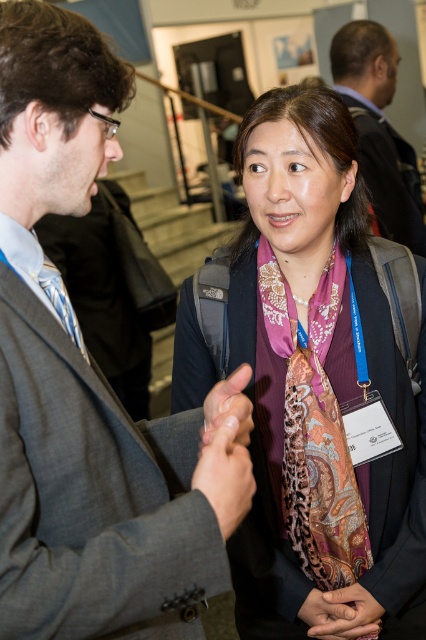
Question: Which object is closer to the camera taking this photo?

Choices:
 (A) matte gray tie at left
 (B) purple silk scarf at center
 (C) dark brown leather jacket at upper right
 (D) paisley-patterned silk scarf at center

Answer: (A)

Question: Which point is closer to the camera?

Choices:
 (A) purple silk scarf at center
 (B) gray suit at center
 (C) paisley-patterned silk scarf at center

Answer: (B)

Question: Where is purple silk scarf at center located in relation to dark brown leather jacket at upper right in the image?

Choices:
 (A) below
 (B) above

Answer: (A)

Question: Does paisley-patterned silk scarf at center appear over matte gray tie at left?

Choices:
 (A) yes
 (B) no

Answer: (B)

Question: Is purple silk scarf at center closer to camera compared to matte gray tie at left?

Choices:
 (A) yes
 (B) no

Answer: (B)

Question: Estimate the real-world distances between objects in this image. Which object is closer to the purple silk scarf at center?

Choices:
 (A) matte gray tie at left
 (B) dark brown leather jacket at upper right
 (C) paisley-patterned silk scarf at center
 (D) gray suit at center

Answer: (C)